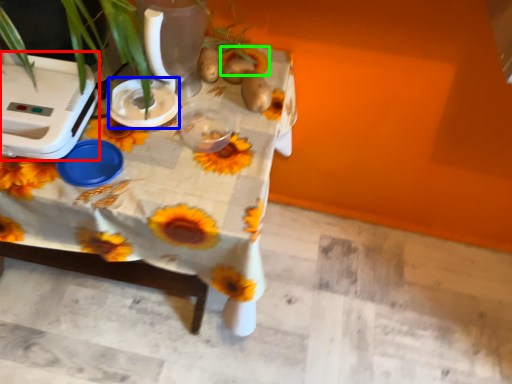
Question: Considering the real-world distances, which object is farthest from appliance (highlighted by a red box)? appliance (highlighted by a blue box) or flower (highlighted by a green box)?

Choices:
 (A) appliance
 (B) flower

Answer: (B)